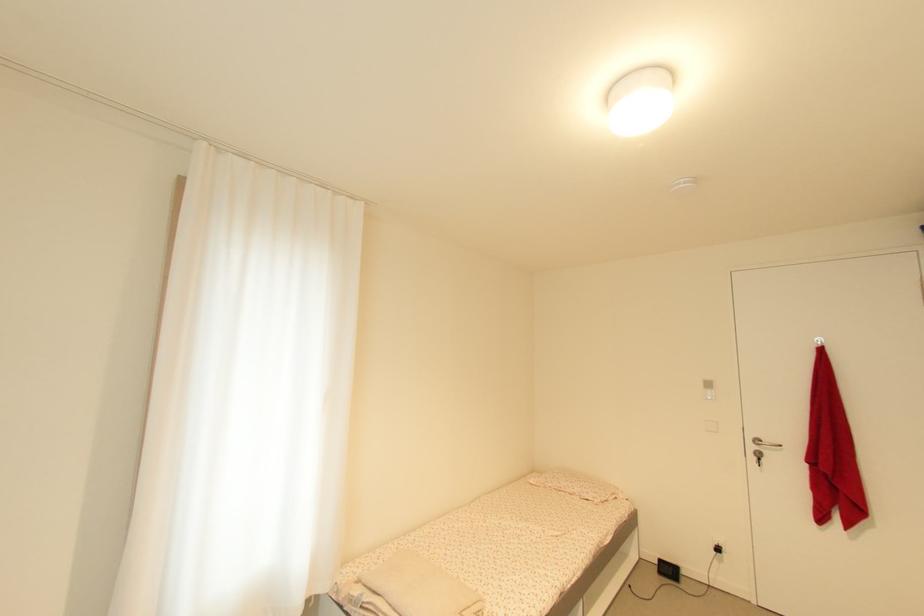
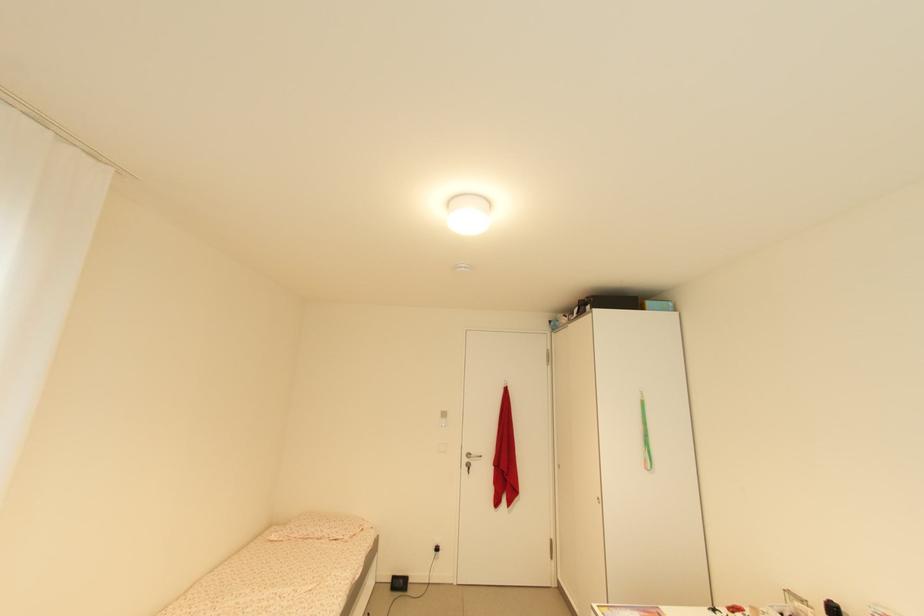
Locate, in the second image, the point that corresponds to the point at 762,443 in the first image.

(473, 456)